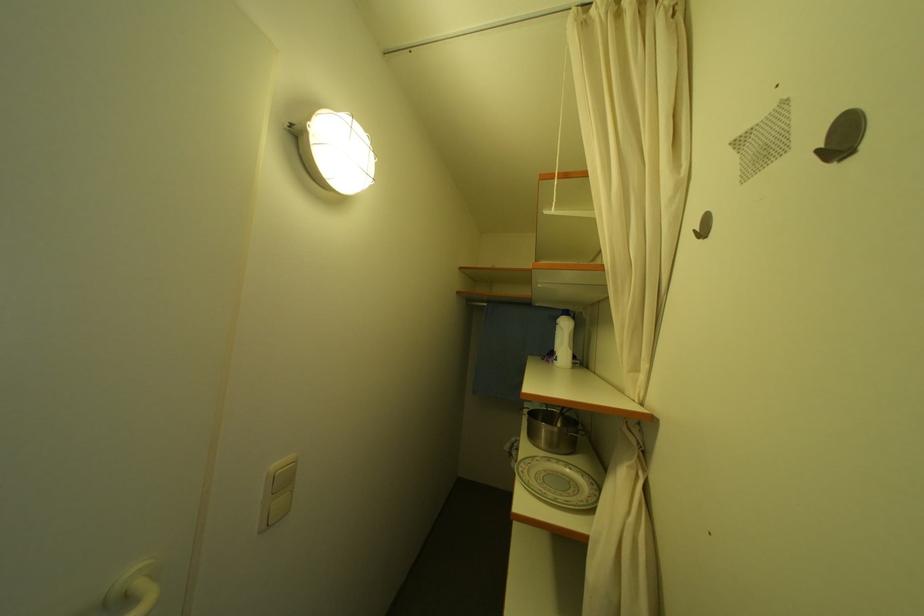
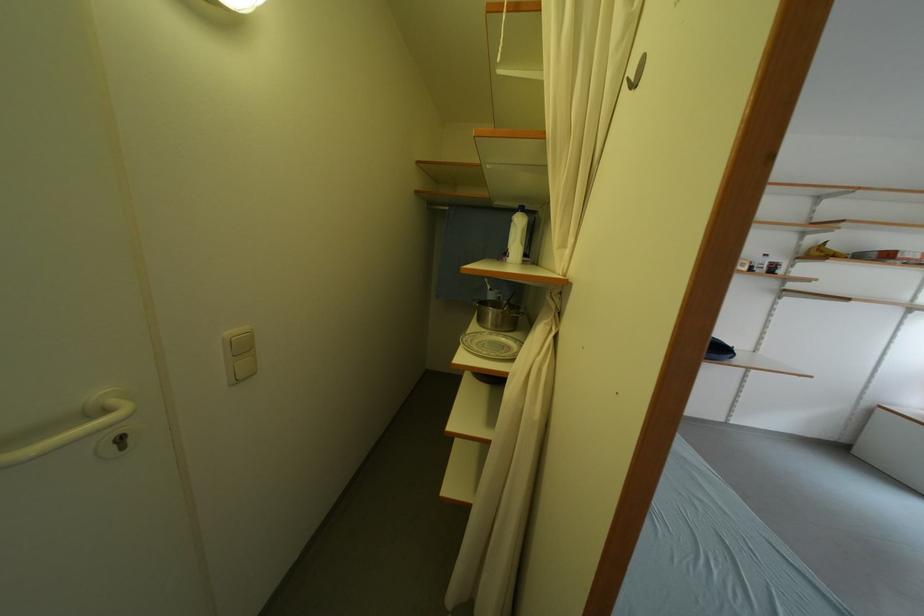
Locate, in the second image, the point that corresponds to point 284,469 in the first image.

(237, 336)